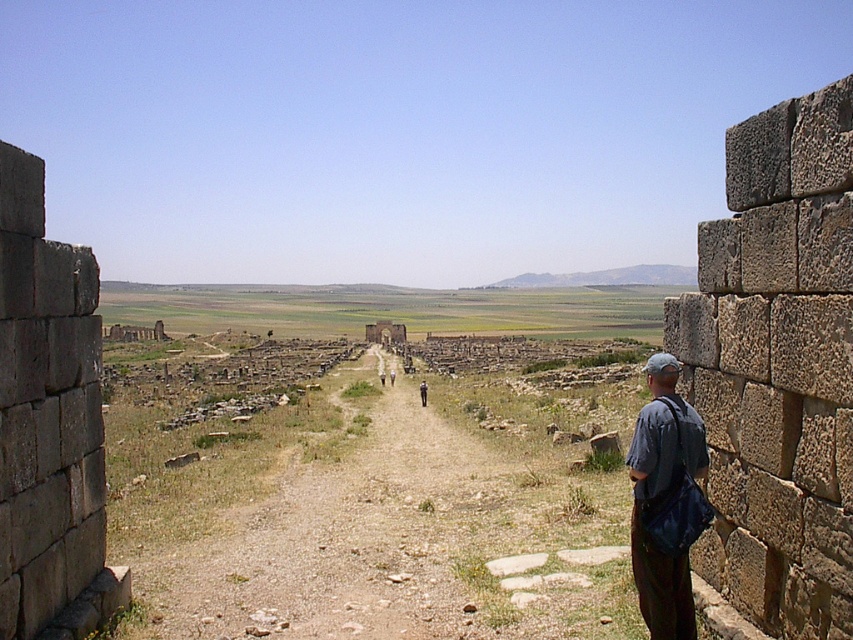
Question: Is brown gravel path at center to the right of brown stone wall at left from the viewer's perspective?

Choices:
 (A) no
 (B) yes

Answer: (B)

Question: Among these objects, which one is nearest to the camera?

Choices:
 (A) stone wall at right
 (B) dark gray fabric bag at right

Answer: (A)

Question: Which of the following is the closest to the observer?

Choices:
 (A) (364, 456)
 (B) (755, 612)

Answer: (B)

Question: Does brown gravel path at center appear under dark blue jeans at center?

Choices:
 (A) yes
 (B) no

Answer: (B)

Question: In this image, where is brown gravel path at center located relative to dark blue jeans at center?

Choices:
 (A) above
 (B) below

Answer: (A)

Question: Which is farther from the dark blue jeans at center?

Choices:
 (A) brown gravel path at center
 (B) stone wall at right
 (C) brown stone wall at left
 (D) dark gray fabric bag at right

Answer: (C)